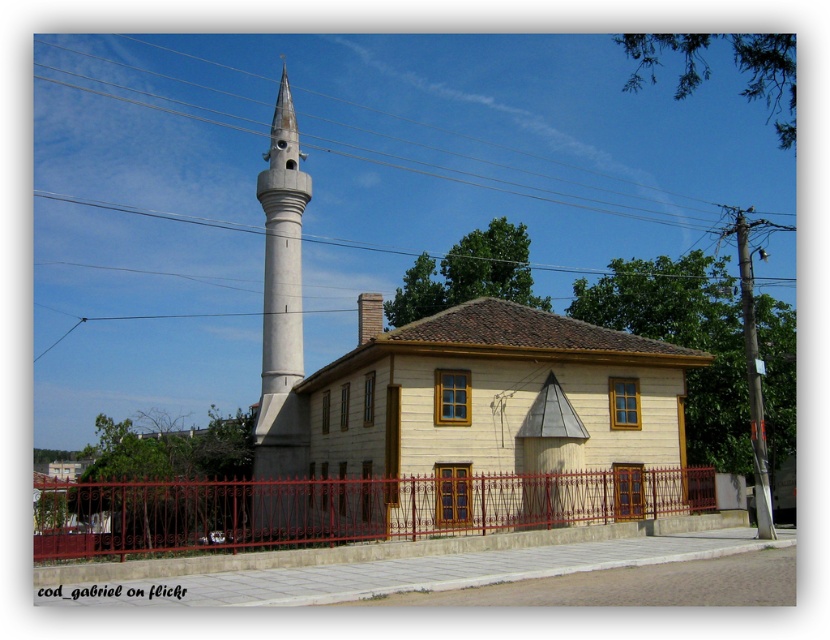
Question: Is red wrought iron fence at lower center further to the viewer compared to white concrete minaret at left?

Choices:
 (A) yes
 (B) no

Answer: (B)

Question: Which point is farther from the camera taking this photo?

Choices:
 (A) (696, 221)
 (B) (64, 525)
 (C) (300, 268)

Answer: (A)

Question: Is red wrought iron fence at lower center wider than metallic wire at upper center?

Choices:
 (A) no
 (B) yes

Answer: (A)

Question: Which point is closer to the camera taking this photo?

Choices:
 (A) (684, 212)
 (B) (282, 58)

Answer: (B)

Question: Is metallic wire at upper center above white concrete minaret at left?

Choices:
 (A) yes
 (B) no

Answer: (A)

Question: Which object appears closest to the camera in this image?

Choices:
 (A) white concrete minaret at left
 (B) red wrought iron fence at lower center

Answer: (B)